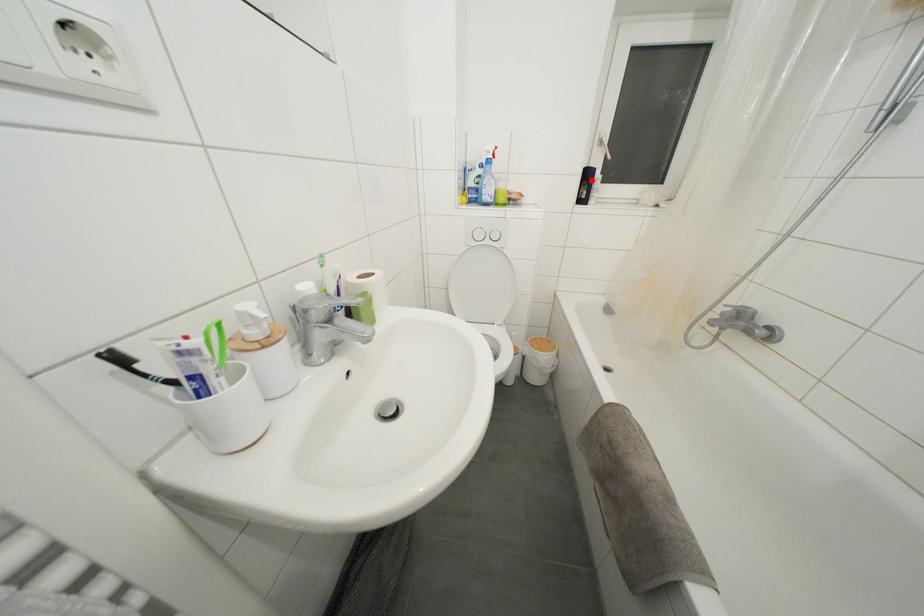
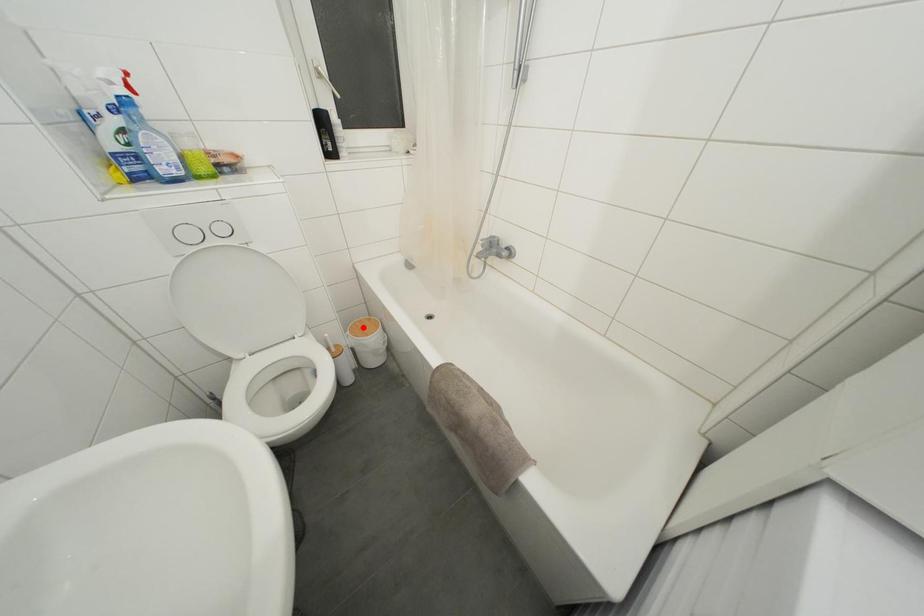
I am providing you with two images of the same scene from different viewpoints. A red point is marked on the first image and another point is marked on the second image. Are the points marked in image1 and image2 representing the same 3D position?

No